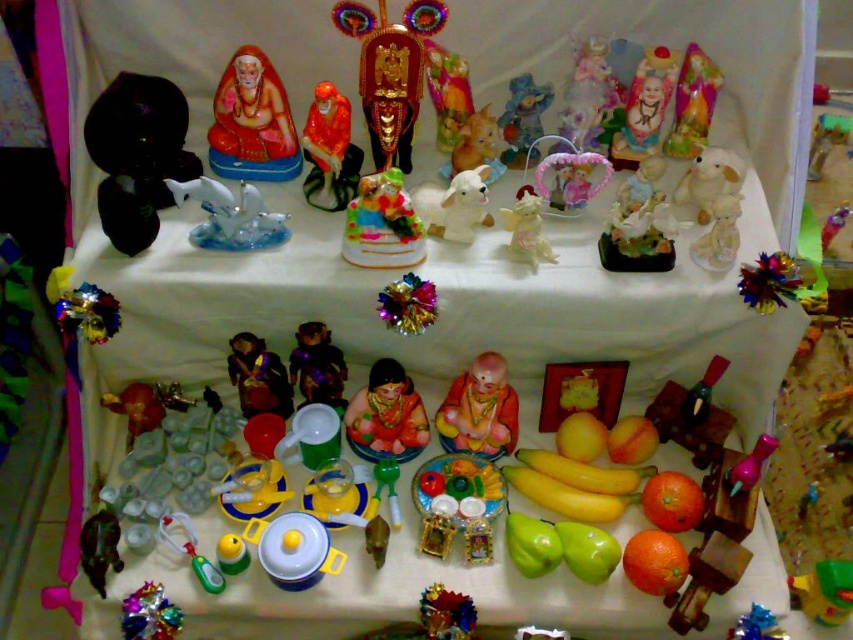
Between black plush bear at left and matte plastic cake at center, which one has more height?

With more height is black plush bear at left.

Looking at this image, can you confirm if black plush bear at left is positioned below matte plastic cake at center?

No.

The width and height of the screenshot is (853, 640). What do you see at coordinates (137, 154) in the screenshot? I see `black plush bear at left` at bounding box center [137, 154].

The width and height of the screenshot is (853, 640). I want to click on black plush bear at left, so click(x=137, y=154).

Is shiny metallic figurine at center below matte plastic teddy bear at center?

Yes.

In order to click on shiny metallic figurine at center in this screenshot , I will do `click(258, 378)`.

Is point (257, 408) behind point (525, 145)?

No, it is in front of (525, 145).

Locate an element on the screen. This screenshot has height=640, width=853. shiny metallic figurine at center is located at coordinates (258, 378).

Is matte orange statue at center in front of white plush rabbit at center?

Yes, it is in front of white plush rabbit at center.

Can you confirm if matte orange statue at center is positioned above white plush rabbit at center?

No.

Does point (457, 376) lie behind point (474, 147)?

No, it is in front of (474, 147).

You are a GUI agent. You are given a task and a screenshot of the screen. Output one action in this format:
    pyautogui.click(x=<x>, y=<y>)
    Task: Click on the matte orange statue at center
    Image resolution: width=853 pixels, height=640 pixels.
    Given the screenshot: What is the action you would take?
    coord(479,410)